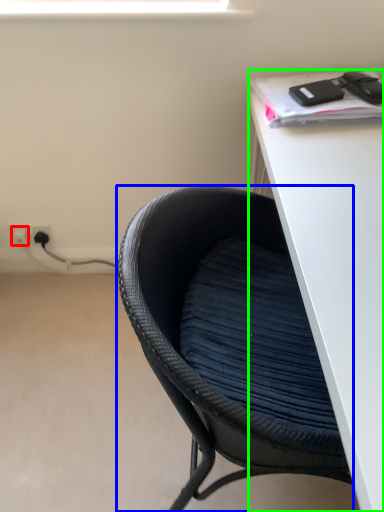
Question: Which object is positioned farthest from electric outlet (highlighted by a red box)? Select from chair (highlighted by a blue box) and desk (highlighted by a green box).

Choices:
 (A) chair
 (B) desk

Answer: (B)